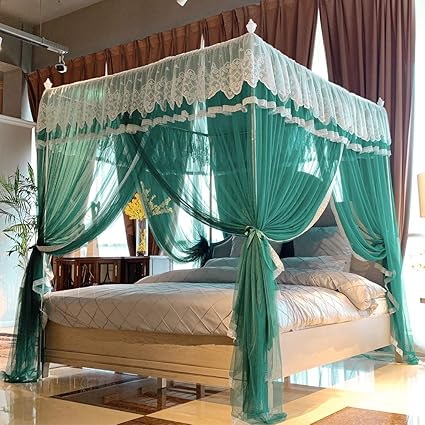
You are a GUI agent. You are given a task and a screenshot of the screen. Output one action in this format:
    pyautogui.click(x=<x>, y=<y>)
    Task: Click on the floor tile
    This screenshot has height=425, width=425.
    Given the screenshot: What is the action you would take?
    pyautogui.click(x=206, y=416)